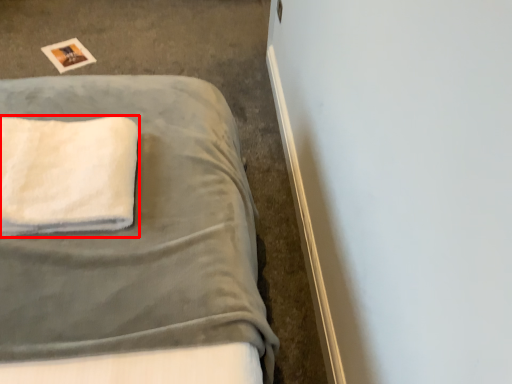
Question: From the image's perspective, what is the correct spatial relationship of towel (annotated by the red box) in relation to bed?

Choices:
 (A) below
 (B) above

Answer: (A)